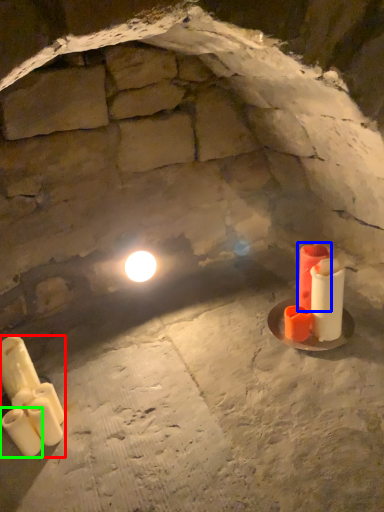
Question: Which object is the farthest from candle (highlighted by a red box)? Choose among these: candle (highlighted by a blue box) or candle (highlighted by a green box).

Choices:
 (A) candle
 (B) candle

Answer: (A)